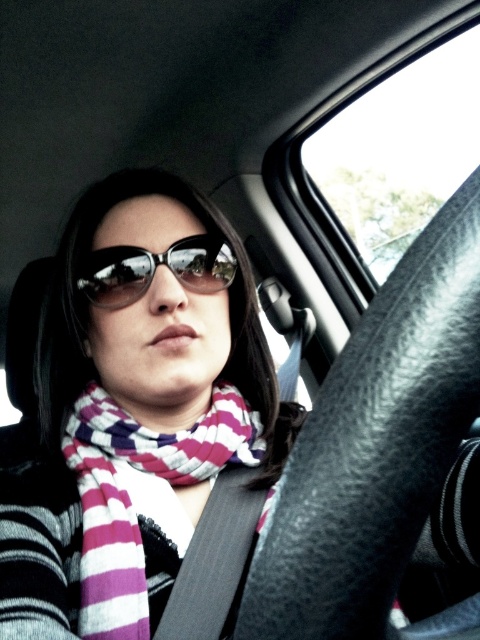
Is point (158, 349) closer to viewer compared to point (223, 412)?

Yes, point (158, 349) is closer to viewer.

This screenshot has width=480, height=640. Identify the location of striped scarf at center. (135, 410).

Is purple striped scarf at center behind black reflective sunglasses at center?

No, it is not.

Does point (110, 435) lie behind point (200, 259)?

No, it is not.

The width and height of the screenshot is (480, 640). Find the location of `purple striped scarf at center`. purple striped scarf at center is located at coordinates (131, 497).

Who is more distant from viewer, (83, 588) or (117, 289)?

Point (117, 289)

Who is higher up, striped scarf at center or black reflective sunglasses at center?

black reflective sunglasses at center is above.

Measure the distance between point (x=268, y=387) and camera.

Point (x=268, y=387) and camera are 32.28 inches apart.

The width and height of the screenshot is (480, 640). I want to click on striped scarf at center, so click(135, 410).